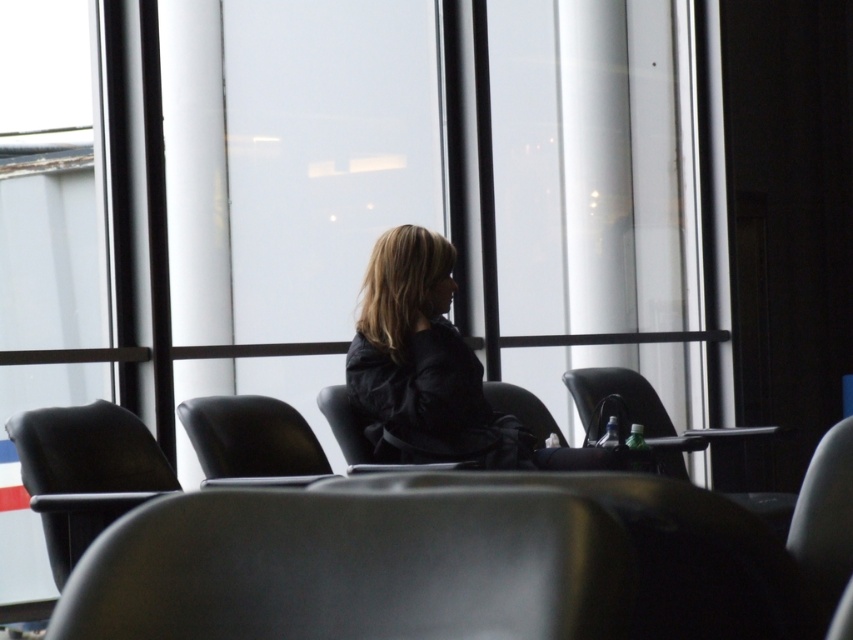
Question: Considering the relative positions of black leather armchair at center and black leather chair at center in the image provided, where is black leather armchair at center located with respect to black leather chair at center?

Choices:
 (A) right
 (B) left

Answer: (B)

Question: Which point is closer to the camera?

Choices:
 (A) (279, 432)
 (B) (68, 560)
 (C) (590, 420)
 (D) (405, 378)

Answer: (B)

Question: Does black matte jacket at center come behind matte black armchair at left?

Choices:
 (A) yes
 (B) no

Answer: (A)

Question: Among these objects, which one is nearest to the camera?

Choices:
 (A) black leather armchair at center
 (B) matte black armchair at left
 (C) black leather chair at center
 (D) black matte jacket at center

Answer: (B)

Question: Which point is farther to the camera?

Choices:
 (A) black leather armchair at center
 (B) black leather chair at center
 (C) matte black armchair at left

Answer: (B)

Question: Does black matte jacket at center appear on the left side of black leather armchair at center?

Choices:
 (A) yes
 (B) no

Answer: (B)